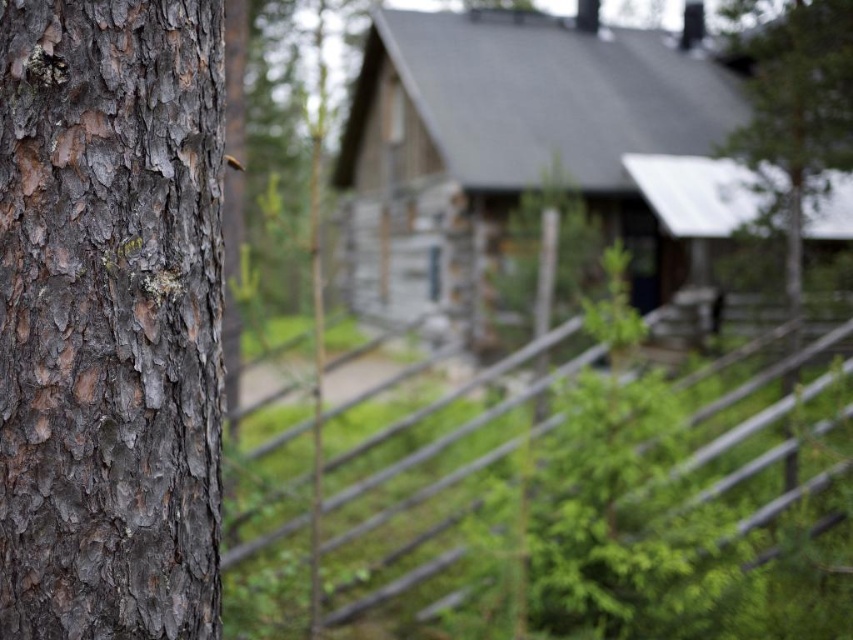
Between dark brown bark at left and wooden at center, which one appears on the right side from the viewer's perspective?

Positioned to the right is wooden at center.

Is dark brown bark at left smaller than wooden at center?

Yes.

Measure the distance between dark brown bark at left and camera.

1.64 meters

The height and width of the screenshot is (640, 853). I want to click on dark brown bark at left, so click(109, 317).

Based on the photo, which is below, wooden cabin at center or green rough bark tree at upper right?

green rough bark tree at upper right is lower down.

Based on the photo, does wooden cabin at center appear under green rough bark tree at upper right?

No, wooden cabin at center is not below green rough bark tree at upper right.

Does point (352, 102) come in front of point (782, 74)?

No, (352, 102) is further to viewer.

Image resolution: width=853 pixels, height=640 pixels. I want to click on wooden cabin at center, so tap(525, 152).

Is wooden cabin at center to the right of wooden at center from the viewer's perspective?

No, wooden cabin at center is not to the right of wooden at center.

Does wooden cabin at center have a greater height compared to wooden at center?

Indeed, wooden cabin at center has a greater height compared to wooden at center.

Does point (705, 64) come farther from viewer compared to point (601, 467)?

Yes.

Where is `wooden cabin at center`? wooden cabin at center is located at coordinates (525, 152).